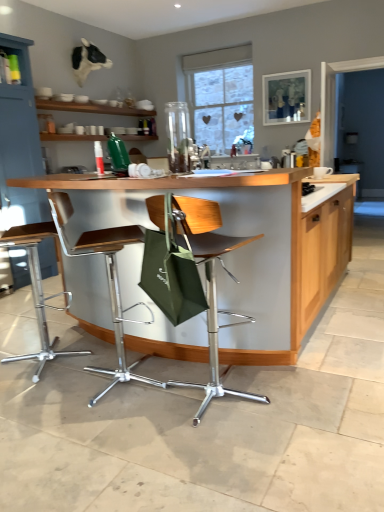
Question: Is metallic silver stool at center, which is the second chair in right-to-left order, inside or outside of wooden countertop at center?

Choices:
 (A) outside
 (B) inside

Answer: (B)

Question: Is metallic silver stool at center, positioned as the second chair in left-to-right order, wider or thinner than wooden countertop at center?

Choices:
 (A) wide
 (B) thin

Answer: (B)

Question: Which object is positioned farthest from the wooden countertop at center?

Choices:
 (A) metallic silver bar stool at lower left, arranged as the 3th chair when viewed from the right
 (B) brown leather chair at center, acting as the 3th chair starting from the left
 (C) transparent glass vase at center
 (D) matte blue cabinet at upper left
 (E) metallic silver stool at center, positioned as the second chair in left-to-right order

Answer: (C)

Question: Which object is the farthest from the wooden countertop at center?

Choices:
 (A) metallic silver stool at center, which is the second chair in right-to-left order
 (B) matte blue cabinet at upper left
 (C) metallic silver bar stool at lower left, arranged as the 3th chair when viewed from the right
 (D) transparent glass vase at center
 (E) brown leather chair at center, acting as the 3th chair starting from the left

Answer: (D)